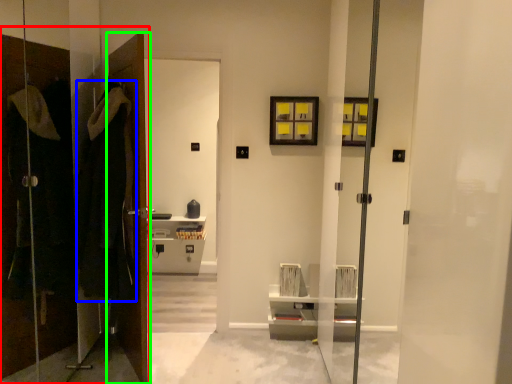
Question: Which object is the closest to the closet (highlighted by a red box)? Choose among these: robe (highlighted by a blue box) or door (highlighted by a green box).

Choices:
 (A) robe
 (B) door

Answer: (A)